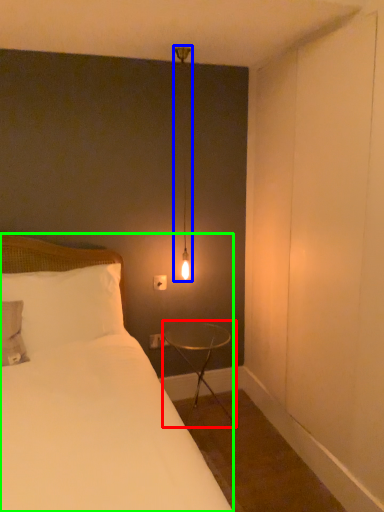
Question: Which is nearer to the table (highlighted by a red box)? light fixture (highlighted by a blue box) or bed (highlighted by a green box).

Choices:
 (A) light fixture
 (B) bed

Answer: (B)